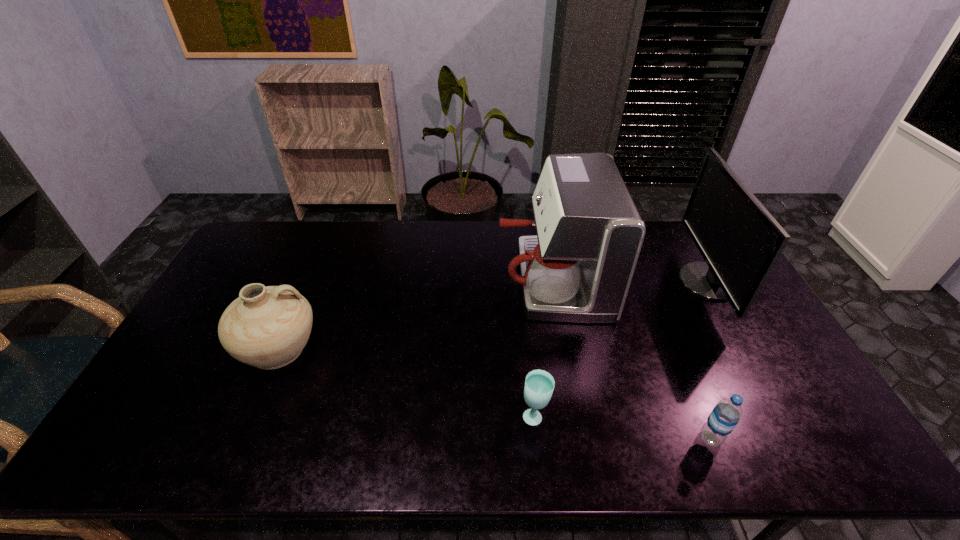
Locate an element on the screen. Image resolution: width=960 pixels, height=540 pixels. coffee maker is located at coordinates (579, 267).

This screenshot has height=540, width=960. Identify the location of monitor. (740, 241).

The image size is (960, 540). What are the coordinates of `the leftmost object` in the screenshot? It's located at (267, 327).

The width and height of the screenshot is (960, 540). I want to click on pottery, so click(x=267, y=327).

Find the location of a particular element. the nearest object is located at coordinates (726, 414).

Find the location of a particular element. This screenshot has height=540, width=960. the fourth object from left to right is located at coordinates (726, 414).

Locate an element on the screen. the fourth farthest object is located at coordinates (539, 385).

Identify the location of glass. (539, 385).

This screenshot has width=960, height=540. I want to click on free location located 0.210m on the front of the coffee maker near the spout, so click(436, 280).

Image resolution: width=960 pixels, height=540 pixels. Find the location of `vacant region located 0.390m on the front of the coffee maker near the spout`. vacant region located 0.390m on the front of the coffee maker near the spout is located at coordinates tap(382, 280).